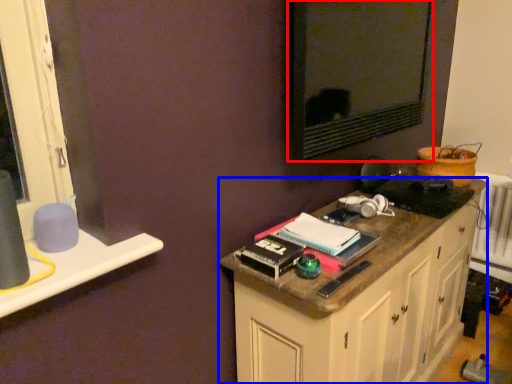
Question: Which object appears farthest to the camera in this image, wide (highlighted by a red box) or cabinetry (highlighted by a blue box)?

Choices:
 (A) wide
 (B) cabinetry

Answer: (A)